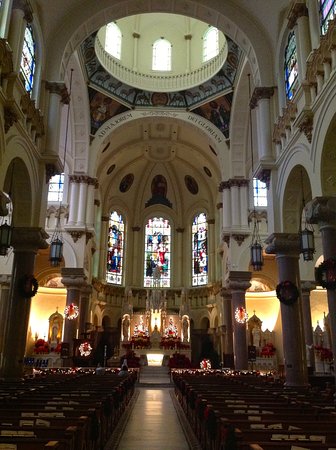
You are a GUI agent. You are given a task and a screenshot of the screen. Output one action in this format:
    pyautogui.click(x=<x>, y=<y>)
    Task: Click on the bench
    This screenshot has width=336, height=450.
    Given the screenshot: What is the action you would take?
    pyautogui.click(x=30, y=444), pyautogui.click(x=38, y=433), pyautogui.click(x=48, y=423), pyautogui.click(x=68, y=413), pyautogui.click(x=272, y=445), pyautogui.click(x=259, y=438), pyautogui.click(x=242, y=426), pyautogui.click(x=234, y=419), pyautogui.click(x=227, y=411)